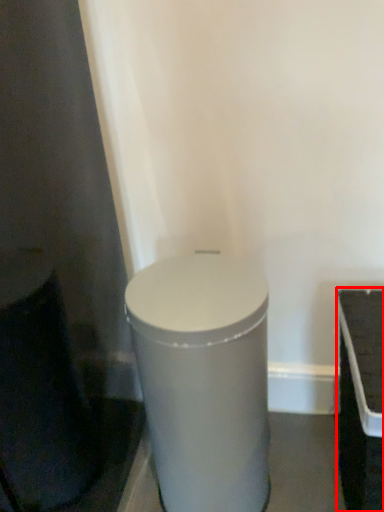
Question: From the image's perspective, considering the relative positions of table (annotated by the red box) and waste container in the image provided, where is table (annotated by the red box) located with respect to the staircase?

Choices:
 (A) above
 (B) below

Answer: (B)